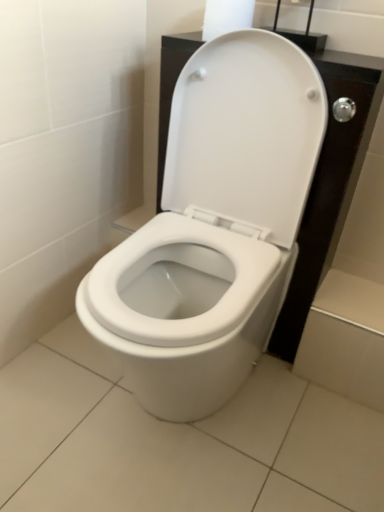
What is the approximate height of white paper at upper center?

white paper at upper center is 4.01 inches tall.

The image size is (384, 512). In order to click on white paper at upper center in this screenshot , I will do `click(226, 17)`.

What do you see at coordinates (226, 17) in the screenshot?
I see `white paper at upper center` at bounding box center [226, 17].

What do you see at coordinates (214, 228) in the screenshot?
I see `white glossy toilet at center` at bounding box center [214, 228].

What is the approximate width of white glossy toilet at center?

63.88 centimeters.

Locate an element on the screen. The image size is (384, 512). white glossy toilet at center is located at coordinates [x=214, y=228].

I want to click on white paper at upper center, so click(x=226, y=17).

Is white glossy toilet at center to the right of white paper at upper center from the viewer's perspective?

No.

Which object is further away from the camera taking this photo, white glossy toilet at center or white paper at upper center?

white paper at upper center is further away from the camera.

Is point (234, 241) farther from camera compared to point (244, 14)?

Yes.

From the image's perspective, would you say white glossy toilet at center is shown under white paper at upper center?

Correct, white glossy toilet at center appears lower than white paper at upper center in the image.

From a real-world perspective, is white glossy toilet at center under white paper at upper center?

Yes, from a real-world perspective, white glossy toilet at center is beneath white paper at upper center.

Based on the photo, considering the relative sizes of white glossy toilet at center and white paper at upper center in the image provided, is white glossy toilet at center thinner than white paper at upper center?

In fact, white glossy toilet at center might be wider than white paper at upper center.

Considering the sizes of objects white glossy toilet at center and white paper at upper center in the image provided, who is taller, white glossy toilet at center or white paper at upper center?

With more height is white glossy toilet at center.

Who is bigger, white glossy toilet at center or white paper at upper center?

white glossy toilet at center is bigger.

Would you say white glossy toilet at center is outside white paper at upper center?

Absolutely, white glossy toilet at center is external to white paper at upper center.

Is there a large distance between white glossy toilet at center and white paper at upper center?

No, white glossy toilet at center is not far away from white paper at upper center.

Is white paper at upper center at the back of white glossy toilet at center?

That's not correct — white glossy toilet at center is not looking away from white paper at upper center.

Measure the distance from white glossy toilet at center to white paper at upper center.

The distance of white glossy toilet at center from white paper at upper center is 17.47 inches.

You are a GUI agent. You are given a task and a screenshot of the screen. Output one action in this format:
    pyautogui.click(x=<x>, y=<y>)
    Task: Click on the toilet below the white paper at upper center (from a real-world perspective)
    The width and height of the screenshot is (384, 512).
    Given the screenshot: What is the action you would take?
    pyautogui.click(x=214, y=228)

Between white paper at upper center and white glossy toilet at center, which one appears on the right side from the viewer's perspective?

Positioned to the right is white paper at upper center.

Which object is closer to the camera, white paper at upper center or white glossy toilet at center?

Positioned in front is white glossy toilet at center.

Considering the positions of points (227, 8) and (280, 291), is point (227, 8) farther from camera compared to point (280, 291)?

No.

From the image's perspective, which one is positioned higher, white paper at upper center or white glossy toilet at center?

white paper at upper center appears higher in the image.

From a real-world perspective, is white paper at upper center positioned above or below white glossy toilet at center?

Clearly, from a real-world perspective, white paper at upper center is above white glossy toilet at center.

Is white paper at upper center wider than white glossy toilet at center?

Incorrect, the width of white paper at upper center does not surpass that of white glossy toilet at center.

Considering the relative sizes of white paper at upper center and white glossy toilet at center in the image provided, is white paper at upper center shorter than white glossy toilet at center?

Yes, white paper at upper center is shorter than white glossy toilet at center.

Which of these two, white paper at upper center or white glossy toilet at center, is smaller?

Smaller between the two is white paper at upper center.

Is white paper at upper center inside the boundaries of white glossy toilet at center, or outside?

white paper at upper center is located beyond the bounds of white glossy toilet at center.

Is white paper at upper center positioned far away from white glossy toilet at center?

Actually, white paper at upper center and white glossy toilet at center are a little close together.

Is white paper at upper center positioned with its back to white glossy toilet at center?

No, white paper at upper center is not facing away from white glossy toilet at center.

How distant is white paper at upper center from white glossy toilet at center?

white paper at upper center is 17.47 inches from white glossy toilet at center.

Find the location of a particular element. toilet paper that is on the right side of white glossy toilet at center is located at coordinates (226, 17).

Find the location of a particular element. The width and height of the screenshot is (384, 512). toilet on the left of white paper at upper center is located at coordinates (214, 228).

At what (x,y) coordinates should I click in order to perform the action: click on toilet below the white paper at upper center (from a real-world perspective). Please return your answer as a coordinate pair (x, y). This screenshot has height=512, width=384. Looking at the image, I should click on (214, 228).